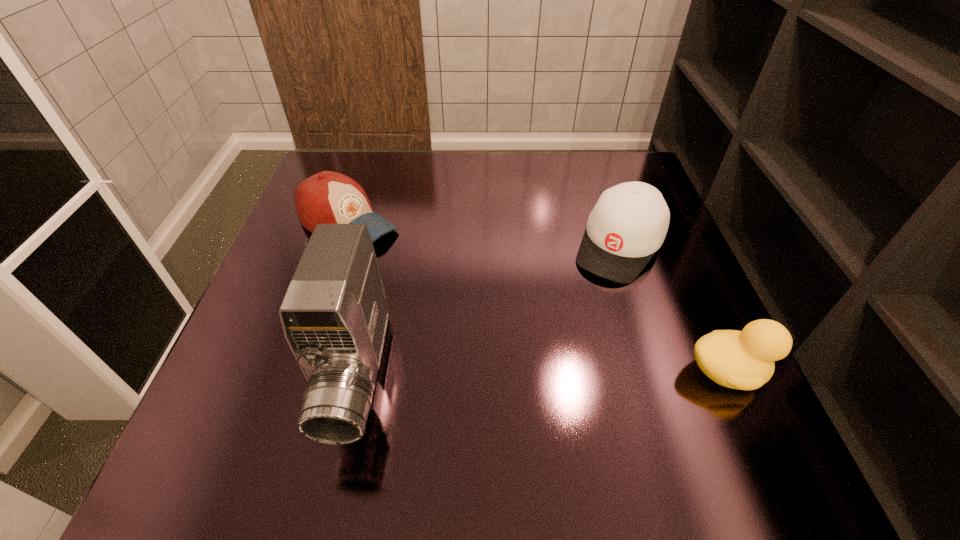
Image resolution: width=960 pixels, height=540 pixels. What are the coordinates of `free space at the left edge of the desktop` in the screenshot? It's located at (295, 230).

The width and height of the screenshot is (960, 540). In the image, there is a desktop. In order to click on free space at the right edge in this screenshot , I will do `click(683, 312)`.

Image resolution: width=960 pixels, height=540 pixels. I want to click on vacant region at the near left corner of the desktop, so click(253, 392).

The height and width of the screenshot is (540, 960). I want to click on free space at the far right corner, so pos(610,174).

The width and height of the screenshot is (960, 540). Find the location of `vacant space in between the right baseball cap and the tallest object`. vacant space in between the right baseball cap and the tallest object is located at coordinates (489, 312).

Find the location of a particular element. The height and width of the screenshot is (540, 960). vacant space in between the left baseball cap and the right baseball cap is located at coordinates (483, 234).

The width and height of the screenshot is (960, 540). I want to click on unoccupied area between the right baseball cap and the tallest object, so click(x=489, y=312).

What are the coordinates of `empty location between the duck and the camcorder` in the screenshot? It's located at (542, 374).

Identify the location of free area in between the right baseball cap and the tallest object. (489, 312).

Image resolution: width=960 pixels, height=540 pixels. Find the location of `blank region between the left baseball cap and the duck`. blank region between the left baseball cap and the duck is located at coordinates (537, 298).